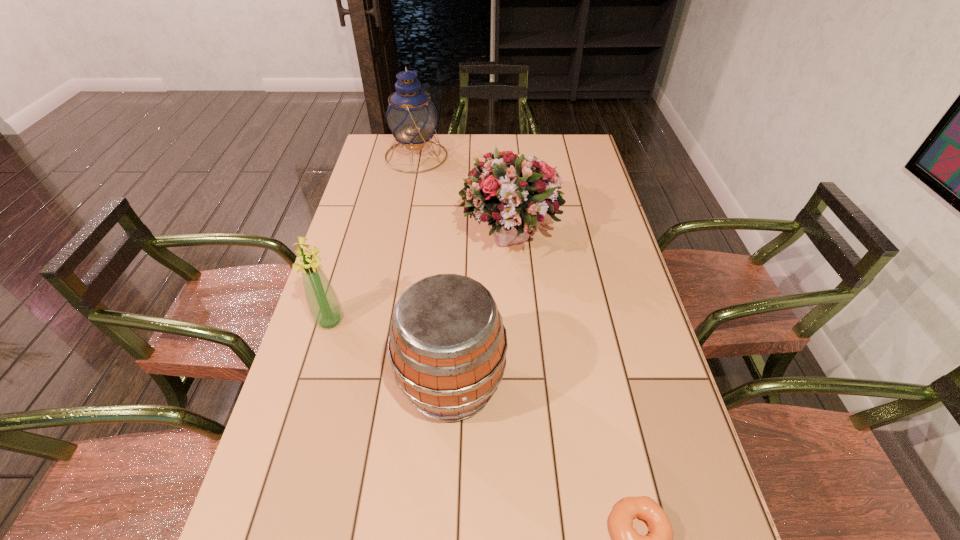
You are a GUI agent. You are given a task and a screenshot of the screen. Output one action in this format:
    pyautogui.click(x=<x>, y=<y>)
    Task: Click on the free space located on the right of the second nearest object
    The image size is (960, 540).
    Given the screenshot: What is the action you would take?
    pyautogui.click(x=551, y=384)

Find the location of a particular element. The image size is (960, 540). object that is at the far edge is located at coordinates click(x=411, y=117).

The height and width of the screenshot is (540, 960). What are the coordinates of `lantern at the left edge` in the screenshot? It's located at (411, 117).

Find the location of a particular element. Image resolution: width=960 pixels, height=540 pixels. bouquet at the left edge is located at coordinates (324, 306).

The image size is (960, 540). In order to click on object that is at the far left corner in this screenshot , I will do `click(411, 117)`.

Locate an element on the screen. This screenshot has width=960, height=540. free space at the far edge of the desktop is located at coordinates (492, 141).

In the image, there is a desktop. At what (x,y) coordinates should I click in order to perform the action: click on vacant space at the left edge. Please return your answer as a coordinate pair (x, y). The image size is (960, 540). Looking at the image, I should click on (341, 256).

In the image, there is a desktop. Find the location of `vacant region at the right edge`. vacant region at the right edge is located at coordinates (657, 459).

This screenshot has width=960, height=540. What are the coordinates of `free space at the far left corner of the desktop` in the screenshot? It's located at (396, 163).

I want to click on free space between the farthest object and the left bouquet, so click(x=373, y=238).